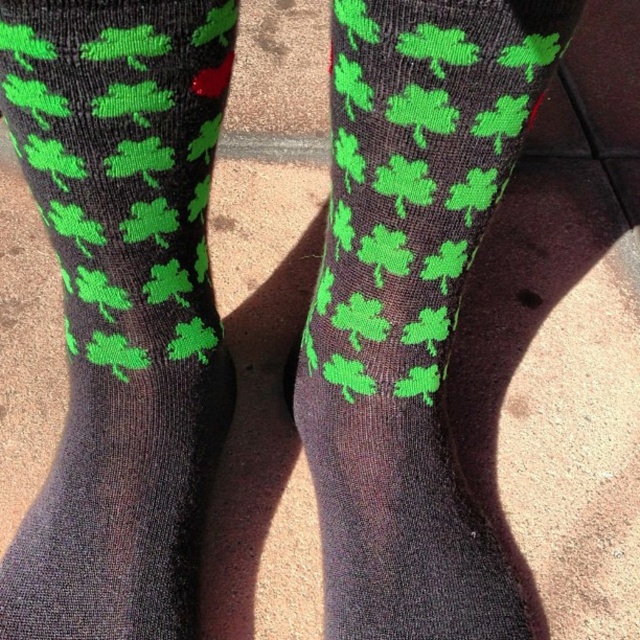
Question: Can you confirm if matte black socks at left is bigger than matte black socks at center?

Choices:
 (A) no
 (B) yes

Answer: (B)

Question: Is the position of matte black socks at left more distant than that of matte black socks at center?

Choices:
 (A) yes
 (B) no

Answer: (B)

Question: Can you confirm if matte black socks at left is bigger than matte black socks at center?

Choices:
 (A) yes
 (B) no

Answer: (A)

Question: Which point appears farthest from the camera in this image?

Choices:
 (A) (544, 80)
 (B) (90, 100)

Answer: (A)